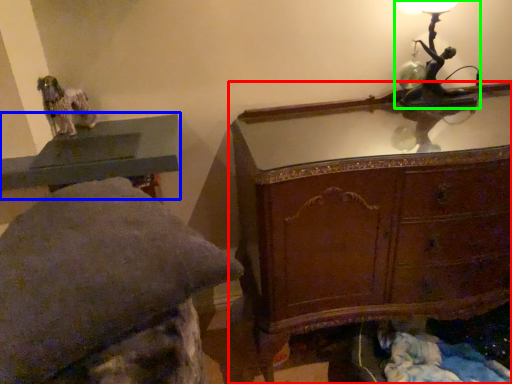
Question: Estimate the real-world distances between objects in this image. Which object is closer to chest of drawers (highlighted by a red box), table (highlighted by a blue box) or table lamp (highlighted by a green box)?

Choices:
 (A) table
 (B) table lamp

Answer: (B)